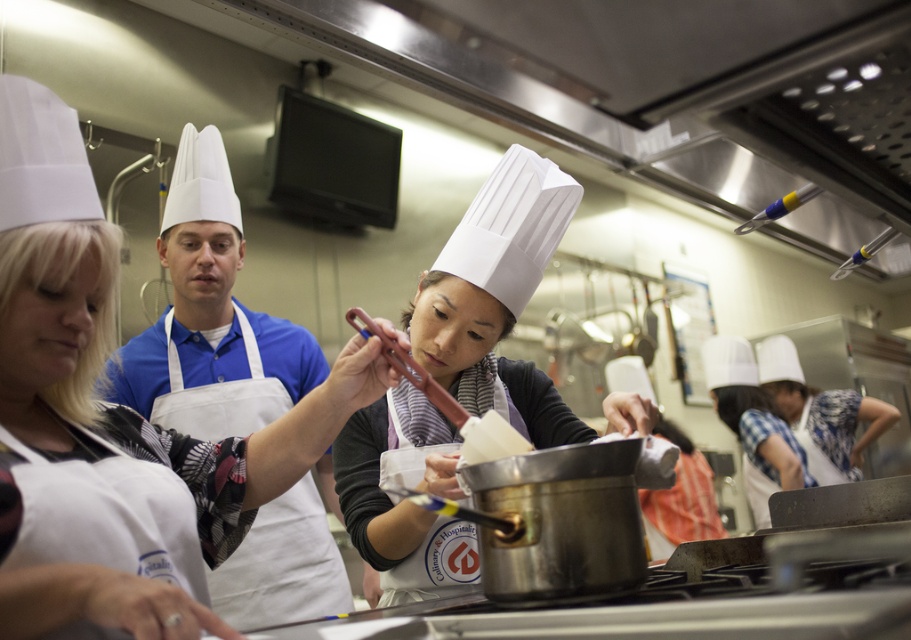
You are a student in the culinary class and need to retrieve your white matte chef hat at upper left from the counter. However, there is another white chef hat at center blocking the path. Can you reach your hat without moving the other hat?

The white matte chef hat at upper left is above the white chef hat at center, so you can reach it without moving the other hat since it is positioned higher.

Consider the image. You are standing in the kitchen and need to reach the point marked at coordinates point (67, 285). Your arm can extend 36 inches. Can you reach it without moving closer?

The distance between point (67, 285) and the camera is 37.75 inches. Since your arm can only extend 36 inches, you cannot reach the point without moving closer.

From the picture: You are a student in the culinary class and need to find the chef hat that is on the left side. Which one is it between the white matte chef hat at upper left and the white matte chef hat at center?

The white matte chef hat at upper left is positioned on the left side of the white matte chef hat at center, so the one on the left is the white matte chef hat at upper left.